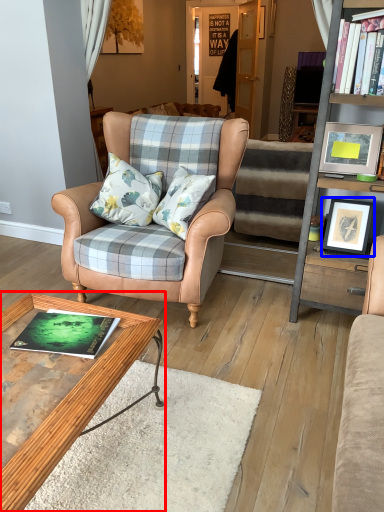
Question: Which object appears closest to the camera in this image, coffee table (highlighted by a red box) or picture frame (highlighted by a blue box)?

Choices:
 (A) coffee table
 (B) picture frame

Answer: (A)